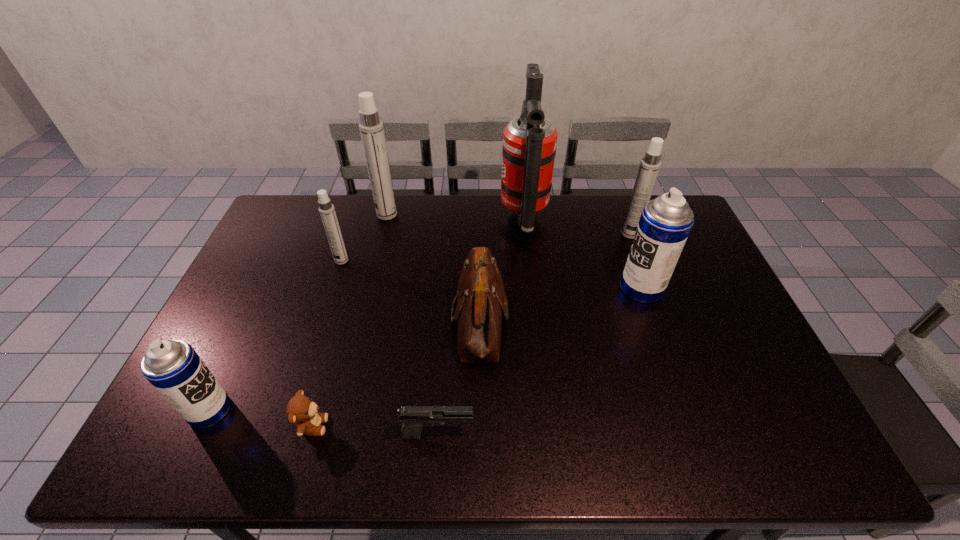
At what (x,y) coordinates should I click in order to perform the action: click on red fire extinguisher. Please return your answer as a coordinate pair (x, y). Looking at the image, I should click on (529, 141).

The width and height of the screenshot is (960, 540). I want to click on the third aerosol can from right to left, so click(371, 127).

What are the coordinates of `the tallest aerosol can` in the screenshot? It's located at (371, 127).

Identify the location of the fourth nearest aerosol can. (649, 167).

At what (x,y) coordinates should I click in order to perform the action: click on the second smallest white aerosol can. Please return your answer as a coordinate pair (x, y). This screenshot has width=960, height=540. Looking at the image, I should click on (649, 167).

What are the coordinates of `the farther blue aerosol can` in the screenshot? It's located at (665, 222).

Where is `the right blue aerosol can`? This screenshot has height=540, width=960. the right blue aerosol can is located at coordinates (665, 222).

Where is `the smallest white aerosol can`? the smallest white aerosol can is located at coordinates (326, 209).

Identify the location of the leftmost white aerosol can. This screenshot has width=960, height=540. (326, 209).

Find the location of a particular element. The image size is (960, 540). the nearer blue aerosol can is located at coordinates (173, 367).